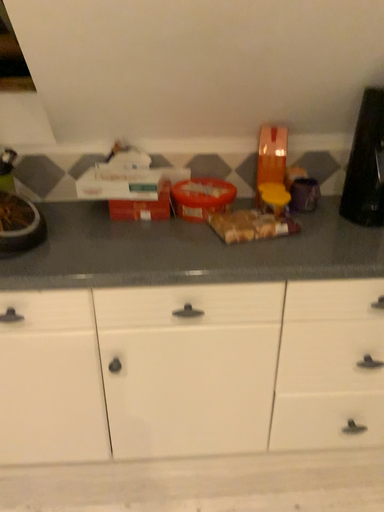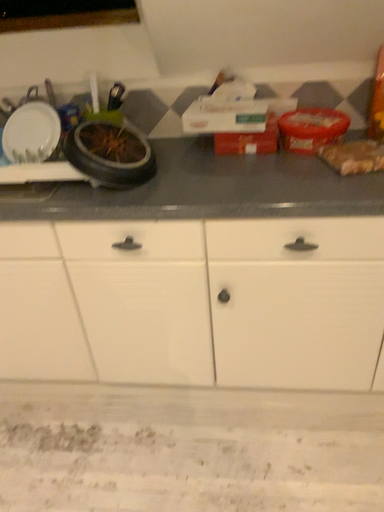
Question: Which way did the camera rotate in the video?

Choices:
 (A) rotated downward
 (B) rotated upward

Answer: (A)